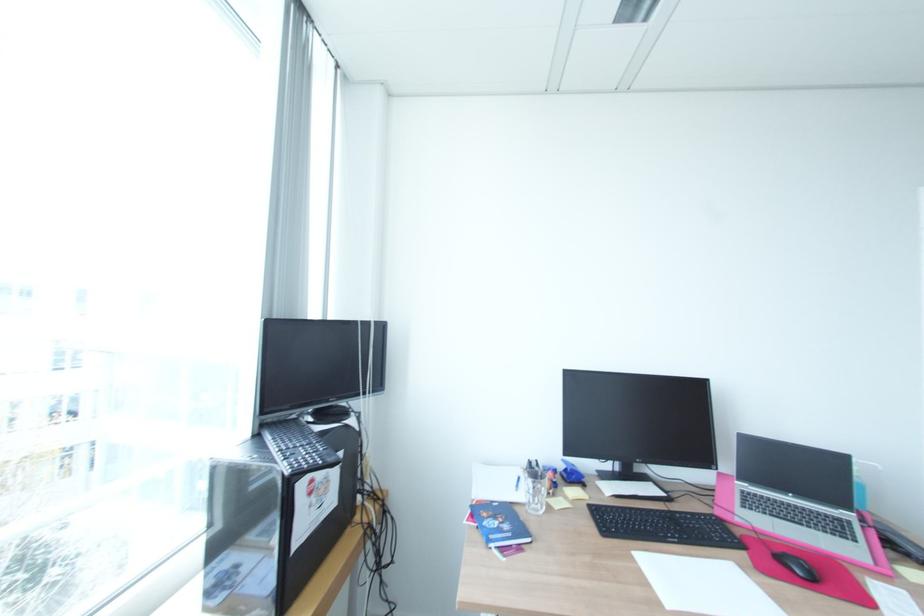
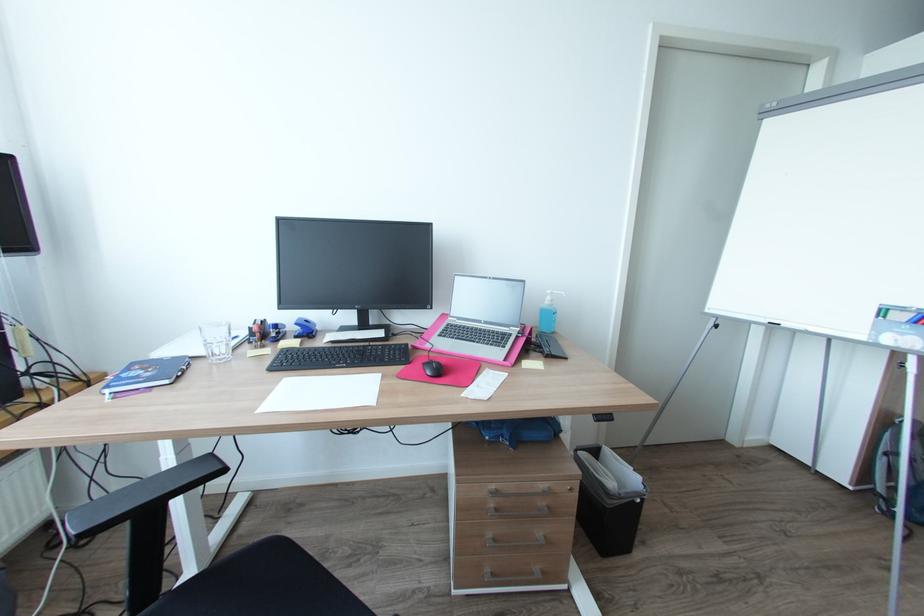
Question: What movement of the cameraman would produce the second image?

Choices:
 (A) Left
 (B) Right
 (C) Forward
 (D) Backward

Answer: (B)